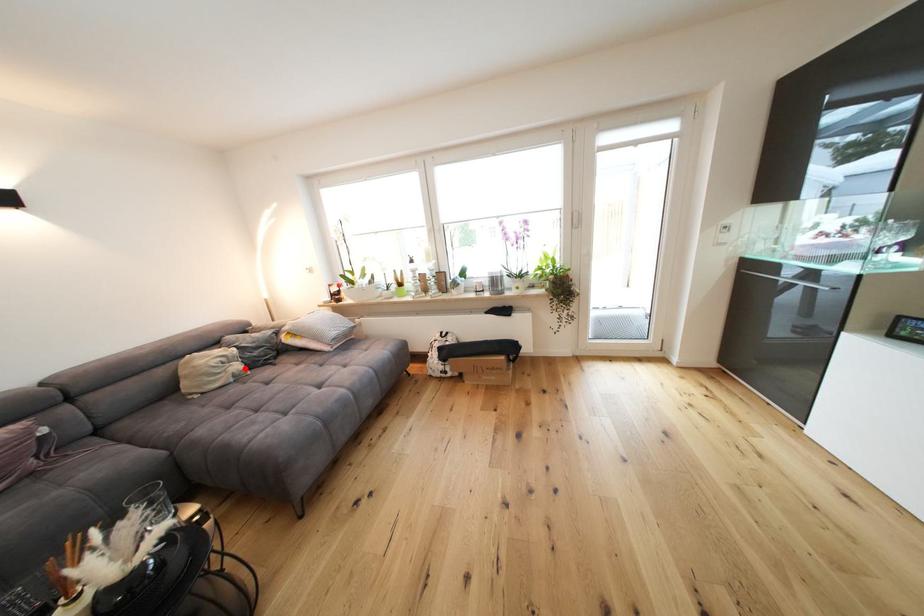
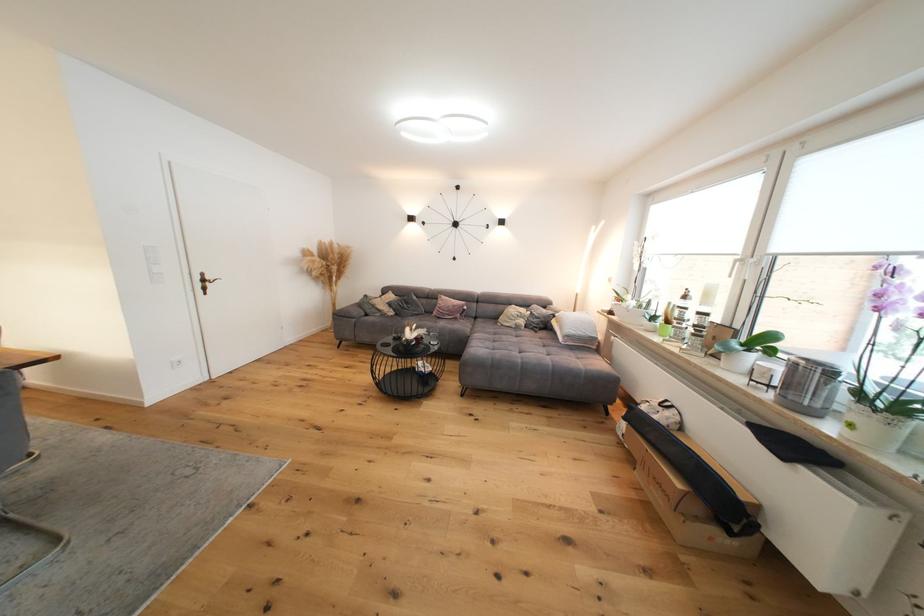
In the second image, find the point that corresponds to the highlighted location in the first image.

(529, 323)